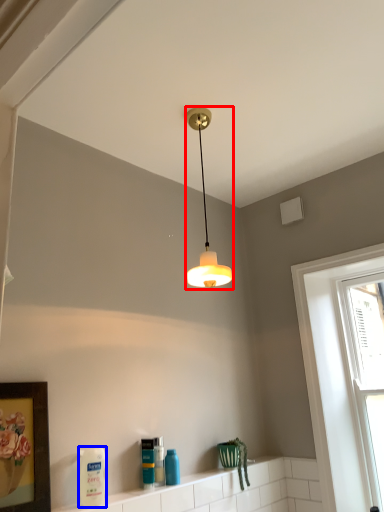
Question: Which object appears farthest to the camera in this image, lamp (highlighted by a red box) or cleaning product (highlighted by a blue box)?

Choices:
 (A) lamp
 (B) cleaning product

Answer: (A)